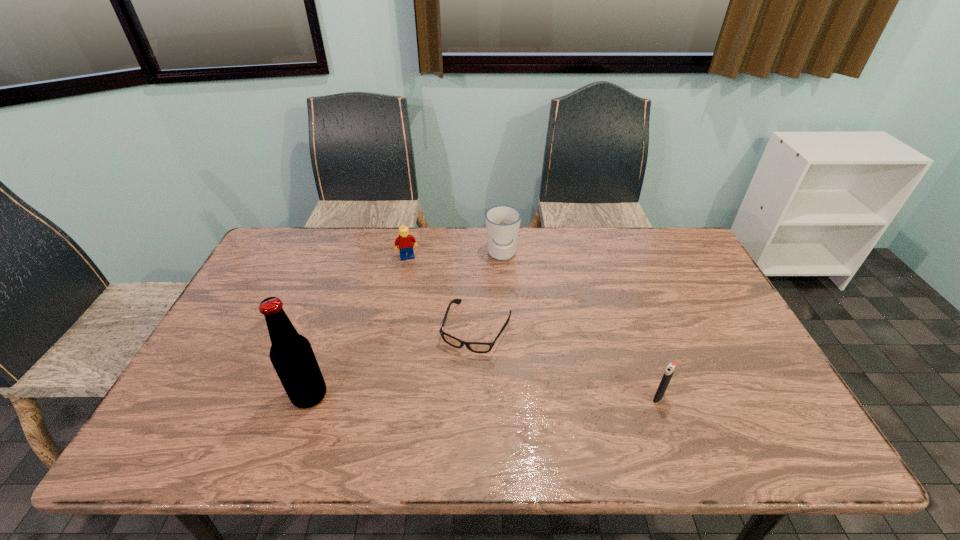
Find the location of a particular element. The height and width of the screenshot is (540, 960). beer bottle is located at coordinates (291, 354).

The width and height of the screenshot is (960, 540). Identify the location of the tallest object. (x=291, y=354).

The width and height of the screenshot is (960, 540). What are the coordinates of `igniter` in the screenshot? It's located at (671, 367).

The image size is (960, 540). Identify the location of the fourth shortest object. (502, 222).

Locate an element on the screen. The height and width of the screenshot is (540, 960). spectacles is located at coordinates pos(477,347).

Image resolution: width=960 pixels, height=540 pixels. I want to click on the shortest object, so click(477, 347).

I want to click on the fourth object from right to left, so click(x=405, y=241).

This screenshot has height=540, width=960. Find the location of `vacant space situated on the left of the tallest object`. vacant space situated on the left of the tallest object is located at coordinates (208, 396).

You are a GUI agent. You are given a task and a screenshot of the screen. Output one action in this format:
    pyautogui.click(x=<x>, y=<y>)
    Task: Click on the free space located on the back of the rightmost object
    This screenshot has height=540, width=960.
    Given the screenshot: What is the action you would take?
    [x=643, y=356]

What are the coordinates of `free space located with a handle on the side of the cup` in the screenshot? It's located at (496, 296).